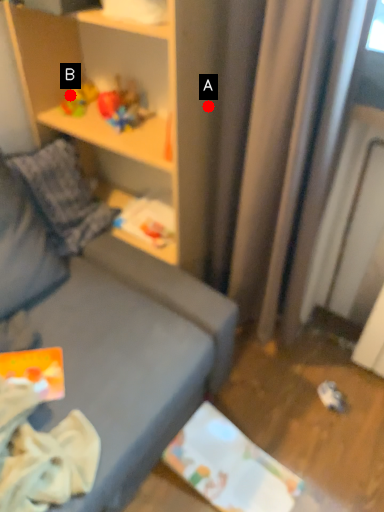
Question: Two points are circled on the image, labeled by A and B beside each circle. Which of the following is the farthest from the observer?

Choices:
 (A) A is further
 (B) B is further

Answer: (B)